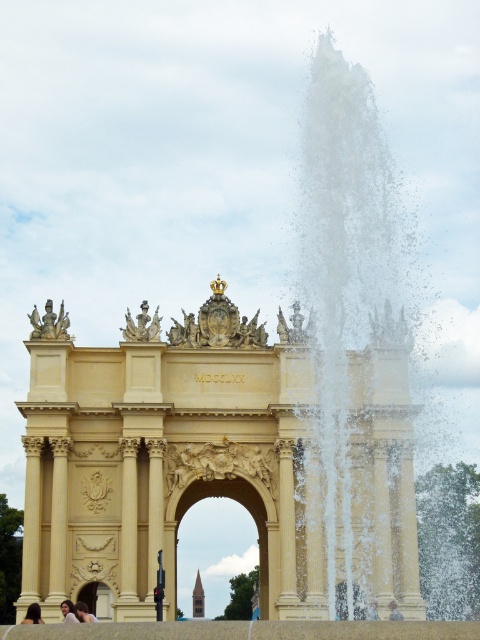
As an engineer assessing the structural integrity of the arch, you need to inspect a specific point on the arch located at coordinates point (37, 604). Given that the point is 121.00 meters away from the camera, can you determine if this point is within a safe inspection distance of 150 meters?

The point (37, 604) is 121.00 meters away from the camera, which is within the safe inspection distance of 150 meters. Therefore, it is safe to proceed with the inspection.